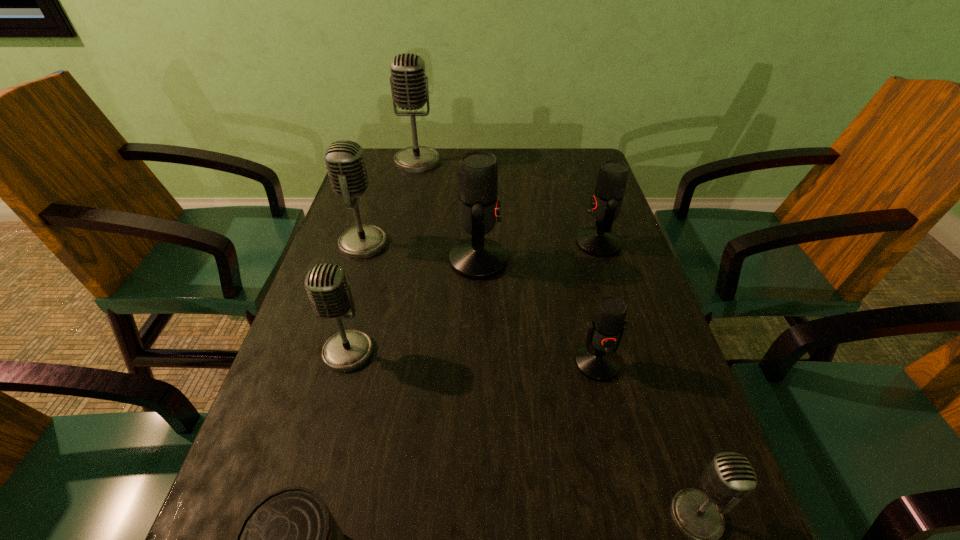
Locate which red microphone ranks in proximity to the leftmost red microphone. Please provide its 2D coordinates. Your answer should be formatted as a tuple, i.e. [(x, y)], where the tuple contains the x and y coordinates of a point satisfying the conditions above.

[(599, 241)]

This screenshot has width=960, height=540. I want to click on red microphone that stands as the second closest to the red can, so click(x=477, y=258).